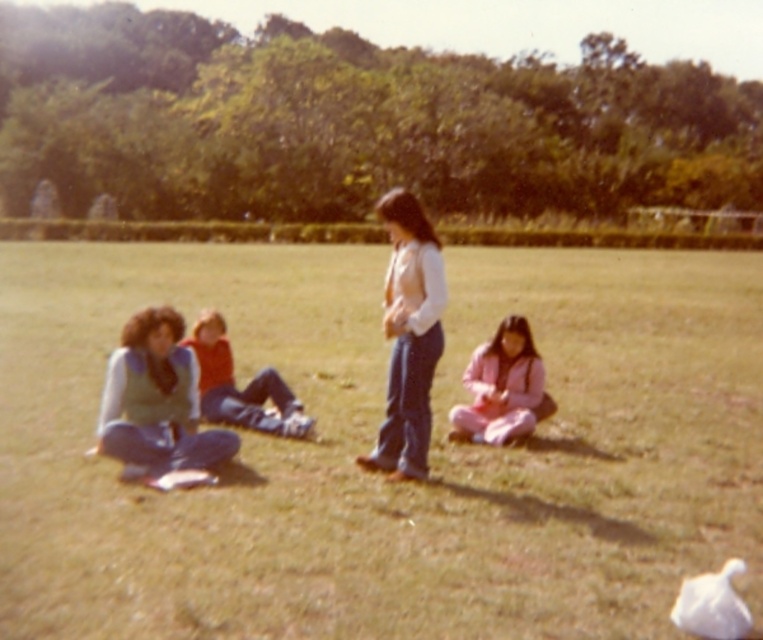
You are standing in the park and see the green grass at center and the white matte vest at center. Which object is positioned to the right of the other?

The green grass at center is to the right of the white matte vest at center.